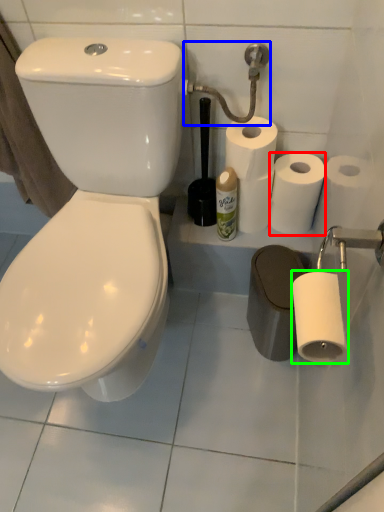
Question: Based on their relative distances, which object is farther from toilet paper (highlighted by a red box)? Choose from shower (highlighted by a blue box) and toilet paper (highlighted by a green box).

Choices:
 (A) shower
 (B) toilet paper

Answer: (B)